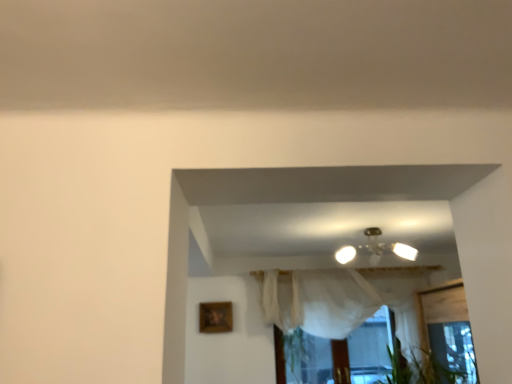
Question: Considering the positions of white sheer curtain at center and wooden picture frame at lower left in the image, is white sheer curtain at center bigger or smaller than wooden picture frame at lower left?

Choices:
 (A) small
 (B) big

Answer: (B)

Question: Is point (285, 314) closer or farther from the camera than point (210, 327)?

Choices:
 (A) farther
 (B) closer

Answer: (B)

Question: Considering the real-world distances, which object is farthest from the metallic glass chandelier at center?

Choices:
 (A) wooden picture frame at lower left
 (B) white sheer curtain at center

Answer: (A)

Question: Which is nearer to the metallic glass chandelier at center?

Choices:
 (A) wooden picture frame at lower left
 (B) white sheer curtain at center

Answer: (B)